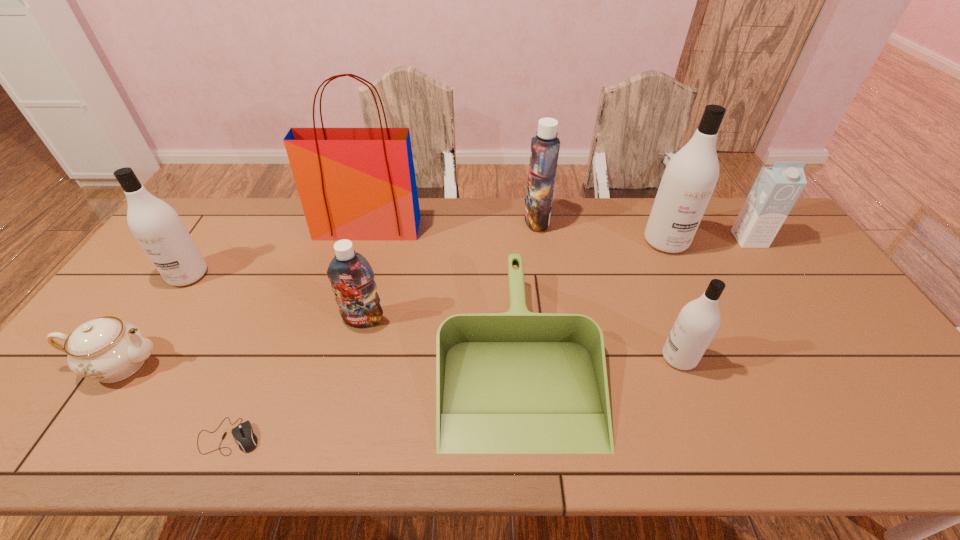
Locate an element on the screen. The image size is (960, 540). dustpan situated at the near edge is located at coordinates (518, 382).

Identify the location of computer mouse at the near edge. The height and width of the screenshot is (540, 960). (243, 433).

At what (x,y) coordinates should I click in order to perform the action: click on shampoo positioned at the left edge. Please return your answer as a coordinate pair (x, y). Looking at the image, I should click on (156, 226).

Locate an element on the screen. The image size is (960, 540). chinaware situated at the left edge is located at coordinates (107, 349).

Where is `object located in the right edge section of the desktop`? This screenshot has width=960, height=540. object located in the right edge section of the desktop is located at coordinates (776, 189).

At what (x,y) coordinates should I click in order to perform the action: click on object located in the far right corner section of the desktop. Please return your answer as a coordinate pair (x, y). This screenshot has height=540, width=960. Looking at the image, I should click on (776, 189).

Identify the location of free space at the far edge of the desktop. (516, 214).

This screenshot has width=960, height=540. I want to click on free space at the near edge, so click(x=436, y=454).

Identify the location of vacant space at the right edge of the desktop. The width and height of the screenshot is (960, 540). (807, 295).

In the image, there is a desktop. What are the coordinates of `vacant space at the near right corner` in the screenshot? It's located at (896, 430).